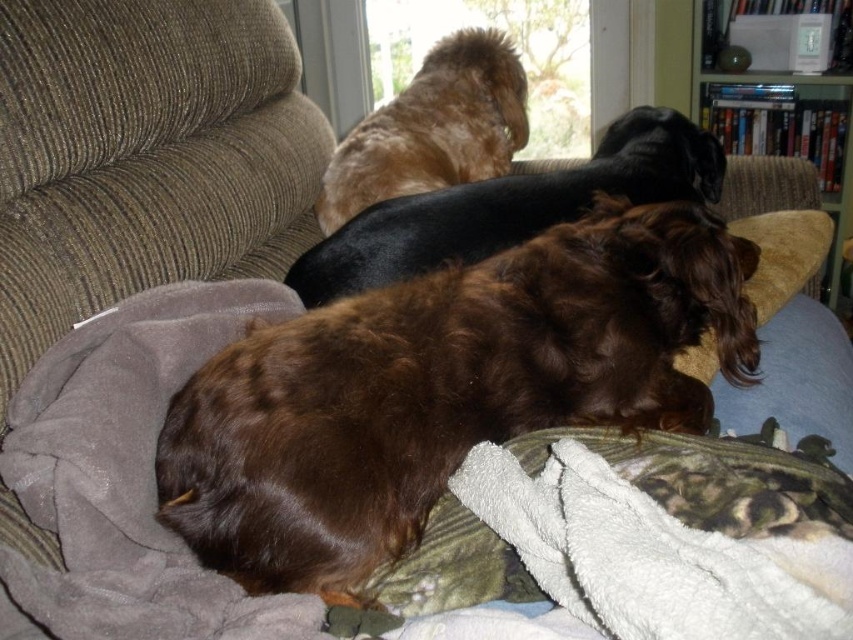
Who is shorter, brown fuzzy dog at center or shiny black dog at center?

shiny black dog at center

Looking at this image, is brown fuzzy dog at center positioned at the back of shiny black dog at center?

No, brown fuzzy dog at center is in front of shiny black dog at center.

Is point (376, 348) positioned in front of point (641, 147)?

Yes, point (376, 348) is in front of point (641, 147).

Where is `brown fuzzy dog at center`? The height and width of the screenshot is (640, 853). brown fuzzy dog at center is located at coordinates (442, 388).

How distant is shiny black dog at center from wooden bookshelf at upper right?

shiny black dog at center and wooden bookshelf at upper right are 3.63 feet apart from each other.

Can you confirm if shiny black dog at center is bigger than wooden bookshelf at upper right?

Indeed, shiny black dog at center has a larger size compared to wooden bookshelf at upper right.

What are the coordinates of `shiny black dog at center` in the screenshot? It's located at (509, 205).

This screenshot has width=853, height=640. Identify the location of shiny black dog at center. (509, 205).

Between shiny black dog at center and shiny brown fur at upper center, which one has less height?

Standing shorter between the two is shiny black dog at center.

Image resolution: width=853 pixels, height=640 pixels. Identify the location of shiny black dog at center. (509, 205).